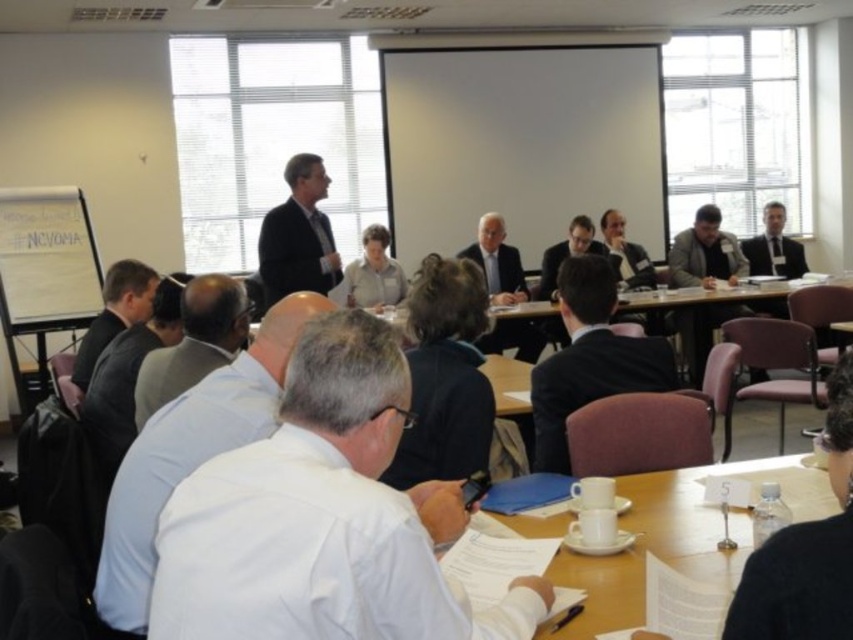
Question: Can you confirm if black suit at center is positioned to the left of dark gray suit at center?

Choices:
 (A) no
 (B) yes

Answer: (B)

Question: Is white shirt at center closer to camera compared to black suit at center?

Choices:
 (A) no
 (B) yes

Answer: (B)

Question: Which of these objects is positioned closest to the white shirt at left?

Choices:
 (A) light brown hair at center
 (B) dark gray suit at left

Answer: (A)

Question: Which object is the farthest from the white shirt at center?

Choices:
 (A) dark suit at center
 (B) light brown hair at center
 (C) black suit at center
 (D) dark gray suit at center

Answer: (D)

Question: Which point is closer to the camera taking this photo?

Choices:
 (A) tap(136, 310)
 (B) tap(363, 621)
 (C) tap(200, 282)

Answer: (B)

Question: Considering the relative positions of white shirt at left and light brown hair at center in the image provided, where is white shirt at left located with respect to light brown hair at center?

Choices:
 (A) below
 (B) above

Answer: (A)